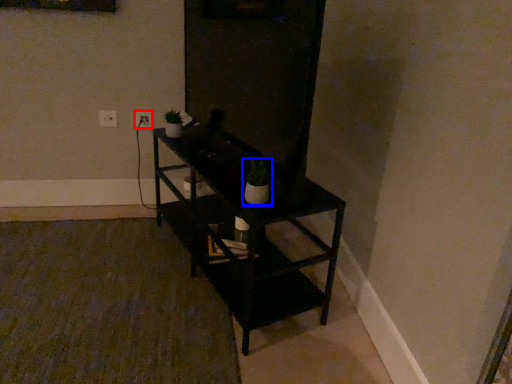
Question: Which object appears closest to the camera in this image, electric outlet (highlighted by a red box) or houseplant (highlighted by a blue box)?

Choices:
 (A) electric outlet
 (B) houseplant

Answer: (B)